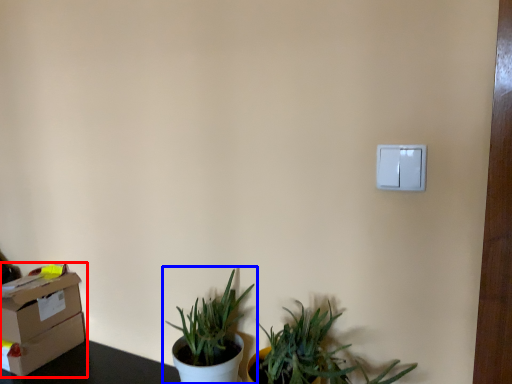
Question: Among these objects, which one is nearest to the camera, cardboard box (highlighted by a red box) or houseplant (highlighted by a blue box)?

Choices:
 (A) cardboard box
 (B) houseplant

Answer: (B)